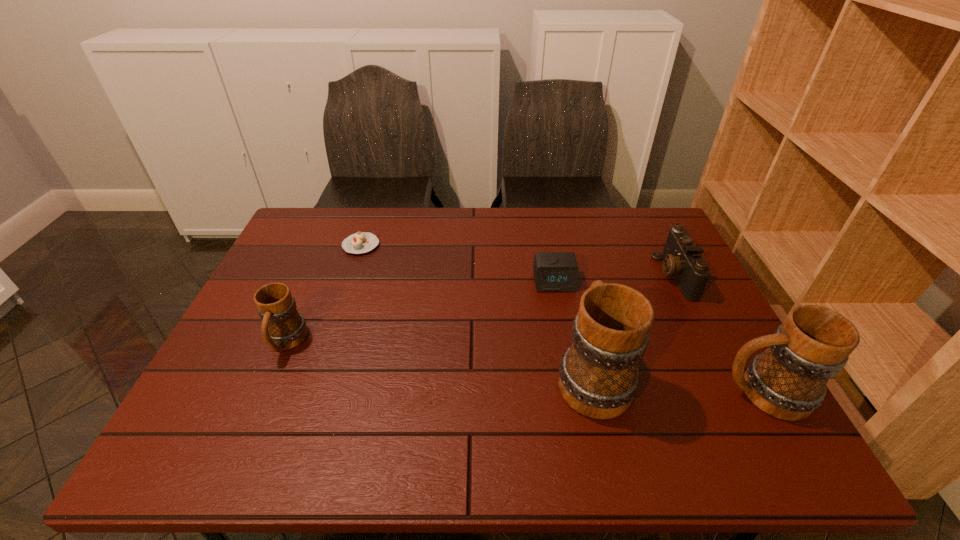
The height and width of the screenshot is (540, 960). I want to click on free location located 0.080m on the side of the second mug from left to right with the handle, so click(x=578, y=313).

Image resolution: width=960 pixels, height=540 pixels. Find the location of `vacant space located 0.270m on the side of the second mug from left to right with the handle`. vacant space located 0.270m on the side of the second mug from left to right with the handle is located at coordinates (567, 268).

At what (x,y) coordinates should I click in order to perform the action: click on vacant space situated 0.180m on the side of the second tallest object with the handle. Please return your answer as a coordinate pair (x, y). The image size is (960, 540). Looking at the image, I should click on (636, 394).

You are a GUI agent. You are given a task and a screenshot of the screen. Output one action in this format:
    pyautogui.click(x=<x>, y=<y>)
    Task: Click on the blank space located on the side of the second tallest object with the handle
    This screenshot has height=540, width=960.
    Given the screenshot: What is the action you would take?
    pyautogui.click(x=614, y=394)

Identify the location of free space located 0.160m on the side of the second tallest object with the handle. pyautogui.click(x=645, y=394).

The height and width of the screenshot is (540, 960). I want to click on vacant space located on the back of the cupcake, so click(x=368, y=225).

You are a GUI agent. You are given a task and a screenshot of the screen. Output one action in this format:
    pyautogui.click(x=<x>, y=<y>)
    Task: Click on the vacant area located on the front-facing side of the fourth tallest object
    The width and height of the screenshot is (960, 540).
    Given the screenshot: What is the action you would take?
    pyautogui.click(x=561, y=275)

Identify the location of vacant space situated 0.190m on the front-facing side of the fourth tallest object. The image size is (960, 540). (594, 275).

Where is `free region located 0.210m on the front-facing side of the fourth tallest object`? The width and height of the screenshot is (960, 540). free region located 0.210m on the front-facing side of the fourth tallest object is located at coordinates (588, 275).

At what (x,y) coordinates should I click in order to perform the action: click on free space located on the front-facing side of the fifth tallest object. Please return your answer as a coordinate pair (x, y). The height and width of the screenshot is (540, 960). Looking at the image, I should click on (573, 381).